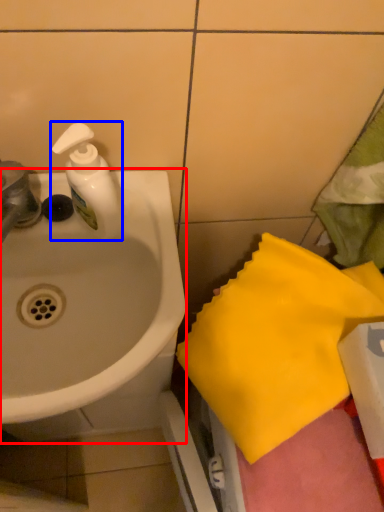
Question: Among these objects, which one is nearest to the camera, sink (highlighted by a red box) or soap dispenser (highlighted by a blue box)?

Choices:
 (A) sink
 (B) soap dispenser

Answer: (A)